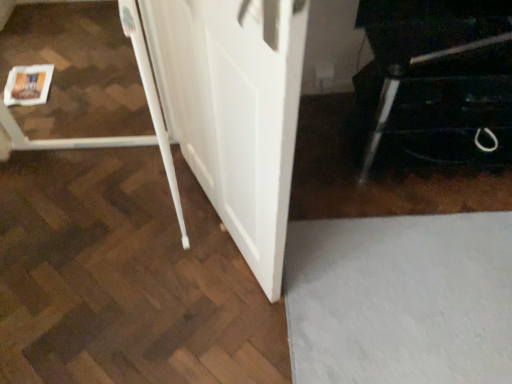
Describe the element at coordinates (439, 79) in the screenshot. I see `black glossy cabinet at lower right` at that location.

Where is `black glossy cabinet at lower right`? This screenshot has height=384, width=512. black glossy cabinet at lower right is located at coordinates (x=439, y=79).

What do you see at coordinates (234, 110) in the screenshot?
I see `white matte barn door at center` at bounding box center [234, 110].

This screenshot has height=384, width=512. Identify the location of white matte barn door at center. (234, 110).

Where is `black glossy cabinet at lower right`? black glossy cabinet at lower right is located at coordinates (439, 79).

Would you say black glossy cabinet at lower right is to the left or to the right of white matte barn door at center in the picture?

Clearly, black glossy cabinet at lower right is on the right of white matte barn door at center in the image.

Which is in front, black glossy cabinet at lower right or white matte barn door at center?

white matte barn door at center is closer to the camera.

Which is farther from the camera, [419,140] or [285,38]?

The point [419,140] is behind.

From the image's perspective, is black glossy cabinet at lower right positioned above or below white matte barn door at center?

Clearly, from the image's perspective, black glossy cabinet at lower right is above white matte barn door at center.

From a real-world perspective, is black glossy cabinet at lower right physically above white matte barn door at center?

Actually, black glossy cabinet at lower right is physically below white matte barn door at center in the real world.

Considering the sizes of objects black glossy cabinet at lower right and white matte barn door at center in the image provided, who is wider, black glossy cabinet at lower right or white matte barn door at center?

black glossy cabinet at lower right.

Is black glossy cabinet at lower right taller than white matte barn door at center?

Incorrect, the height of black glossy cabinet at lower right is not larger of that of white matte barn door at center.

Considering the sizes of objects black glossy cabinet at lower right and white matte barn door at center in the image provided, who is smaller, black glossy cabinet at lower right or white matte barn door at center?

Smaller between the two is white matte barn door at center.

Is black glossy cabinet at lower right spatially inside white matte barn door at center, or outside of it?

black glossy cabinet at lower right is located beyond the bounds of white matte barn door at center.

Would you consider black glossy cabinet at lower right to be distant from white matte barn door at center?

No, black glossy cabinet at lower right is in close proximity to white matte barn door at center.

Is black glossy cabinet at lower right looking in the opposite direction of white matte barn door at center?

That's not correct — black glossy cabinet at lower right is not looking away from white matte barn door at center.

Looking at this image, measure the distance between black glossy cabinet at lower right and white matte barn door at center.

black glossy cabinet at lower right and white matte barn door at center are 29.21 inches apart from each other.

Find the location of a particular element. The width and height of the screenshot is (512, 384). furniture on the right of the white matte barn door at center is located at coordinates (439, 79).

Which is more to the left, white matte barn door at center or black glossy cabinet at lower right?

white matte barn door at center is more to the left.

Which object is further away from the camera, white matte barn door at center or black glossy cabinet at lower right?

black glossy cabinet at lower right is more distant.

Does point (194, 170) lie in front of point (469, 64)?

No, it is behind (469, 64).

From the image's perspective, between white matte barn door at center and black glossy cabinet at lower right, which one is located above?

From the image's view, black glossy cabinet at lower right is above.

From a real-world perspective, who is located lower, white matte barn door at center or black glossy cabinet at lower right?

black glossy cabinet at lower right is physically lower.

Looking at their sizes, would you say white matte barn door at center is wider or thinner than black glossy cabinet at lower right?

Clearly, white matte barn door at center has less width compared to black glossy cabinet at lower right.

From their relative heights in the image, would you say white matte barn door at center is taller or shorter than black glossy cabinet at lower right?

In the image, white matte barn door at center appears to be taller than black glossy cabinet at lower right.

Who is smaller, white matte barn door at center or black glossy cabinet at lower right?

white matte barn door at center is smaller.

Do you think white matte barn door at center is within black glossy cabinet at lower right, or outside of it?

white matte barn door at center lies outside black glossy cabinet at lower right.

Is the surface of white matte barn door at center in direct contact with black glossy cabinet at lower right?

white matte barn door at center and black glossy cabinet at lower right are not in contact.

Is white matte barn door at center oriented towards black glossy cabinet at lower right?

No, white matte barn door at center is not turned towards black glossy cabinet at lower right.

What's the angular difference between white matte barn door at center and black glossy cabinet at lower right's facing directions?

There is a 63.6-degree angle between the facing directions of white matte barn door at center and black glossy cabinet at lower right.

Looking at this image, measure the distance between white matte barn door at center and black glossy cabinet at lower right.

A distance of 29.21 inches exists between white matte barn door at center and black glossy cabinet at lower right.

Locate an element on the screen. barn door that is above the black glossy cabinet at lower right (from a real-world perspective) is located at coordinates (234, 110).

Identify the location of barn door on the left of black glossy cabinet at lower right. (234, 110).

Identify the location of furniture that appears behind the white matte barn door at center. This screenshot has height=384, width=512. (439, 79).